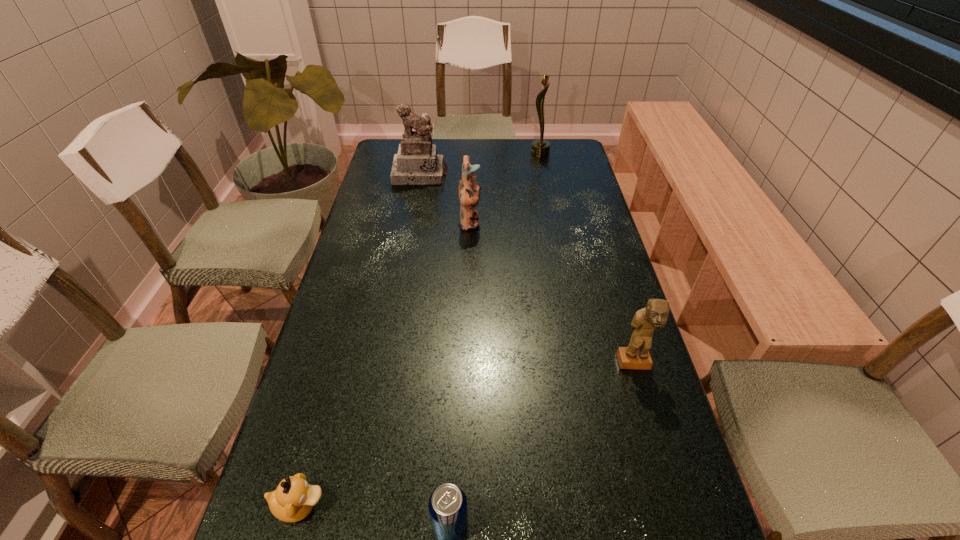
Point out which object is positioned as the second nearest to the beer can. Please provide its 2D coordinates. Your answer should be formatted as a tuple, i.e. [(x, y)], where the tuple contains the x and y coordinates of a point satisfying the conditions above.

[(636, 356)]

Choose which object is the nearest neighbor to the duckling. Please provide its 2D coordinates. Your answer should be formatted as a tuple, i.e. [(x, y)], where the tuple contains the x and y coordinates of a point satisfying the conditions above.

[(447, 505)]

What are the coordinates of `the second closest figurine to the leftmost figurine` in the screenshot? It's located at (636, 356).

Identify which figurine is the closest to the third farthest object. Please provide its 2D coordinates. Your answer should be formatted as a tuple, i.e. [(x, y)], where the tuple contains the x and y coordinates of a point satisfying the conditions above.

[(417, 163)]

The height and width of the screenshot is (540, 960). Identify the location of free space in the image that satisfies the following two spatial constraints: 1. on the front-facing side of the fifth object from left to right; 2. on the front-facing side of the farthest figurine. (544, 174).

You are a GUI agent. You are given a task and a screenshot of the screen. Output one action in this format:
    pyautogui.click(x=<x>, y=<y>)
    Task: Click on the free spot that satisfies the following two spatial constraints: 1. on the front-facing side of the second farthest object; 2. on the face of the duckling
    
    Given the screenshot: What is the action you would take?
    pyautogui.click(x=358, y=505)

At what (x,y) coordinates should I click in order to perform the action: click on free spot that satisfies the following two spatial constraints: 1. on the front-facing side of the rightmost figurine; 2. on the face of the shortest object. Please return your answer as a coordinate pair (x, y). The width and height of the screenshot is (960, 540). Looking at the image, I should click on (677, 505).